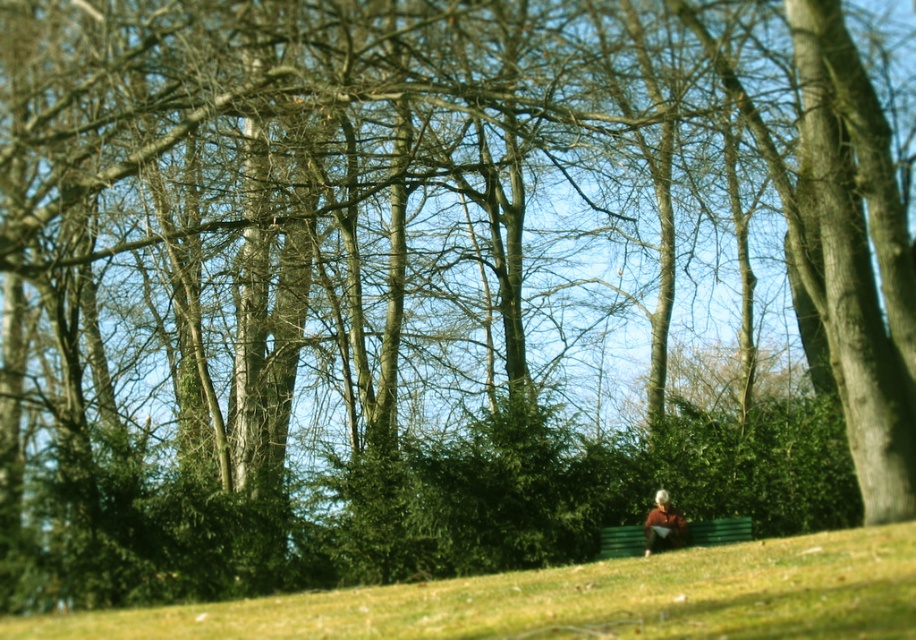
Question: Does green grassy hillside at lower center have a greater width compared to blurred beige jacket at lower right?

Choices:
 (A) no
 (B) yes

Answer: (B)

Question: Which object is the farthest from the blurred beige jacket at lower right?

Choices:
 (A) green grassy hillside at lower center
 (B) green wooden bench at lower center

Answer: (A)

Question: Observing the image, what is the correct spatial positioning of green wooden bench at lower center in reference to blurred beige jacket at lower right?

Choices:
 (A) above
 (B) below

Answer: (B)

Question: Does green grassy hillside at lower center have a greater width compared to blurred beige jacket at lower right?

Choices:
 (A) yes
 (B) no

Answer: (A)

Question: Which point is closer to the camera taking this photo?

Choices:
 (A) (729, 532)
 (B) (673, 532)
 (C) (529, 608)

Answer: (C)

Question: Among these objects, which one is farthest from the camera?

Choices:
 (A) blurred beige jacket at lower right
 (B) green grassy hillside at lower center

Answer: (A)